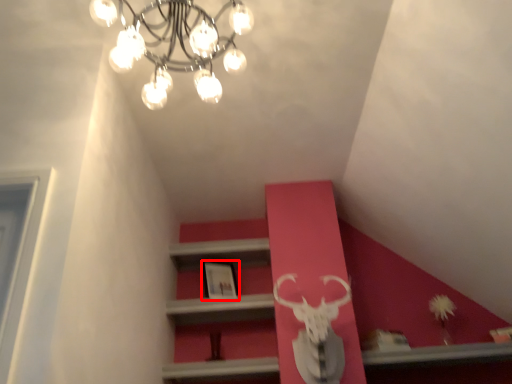
Question: In this image, where is picture frame (annotated by the red box) located relative to lamp?

Choices:
 (A) right
 (B) left

Answer: (A)